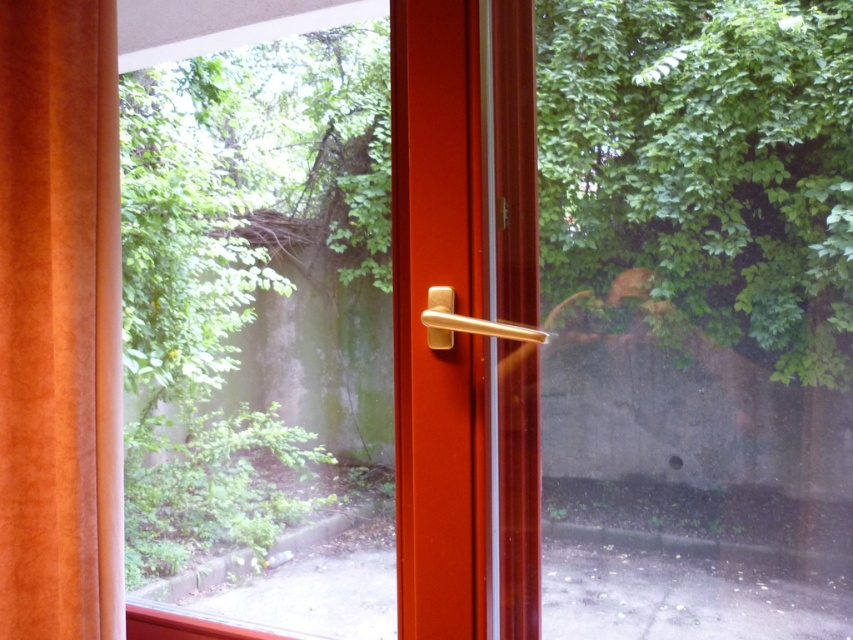
Is point (529, 417) more distant than point (445, 292)?

Yes.

The height and width of the screenshot is (640, 853). Describe the element at coordinates (465, 314) in the screenshot. I see `matte gold handle at center` at that location.

Consider the image. Who is more forward, (416, 513) or (444, 332)?

Positioned in front is point (444, 332).

Where is `matte gold handle at center`? The image size is (853, 640). matte gold handle at center is located at coordinates (465, 314).

Can you confirm if suede orange curtain at left is positioned below gold metallic door handle at center?

Incorrect, suede orange curtain at left is not positioned below gold metallic door handle at center.

Does suede orange curtain at left come behind gold metallic door handle at center?

That is True.

Locate an element on the screen. Image resolution: width=853 pixels, height=640 pixels. suede orange curtain at left is located at coordinates click(x=59, y=321).

Identify the location of matte gold handle at center. (465, 314).